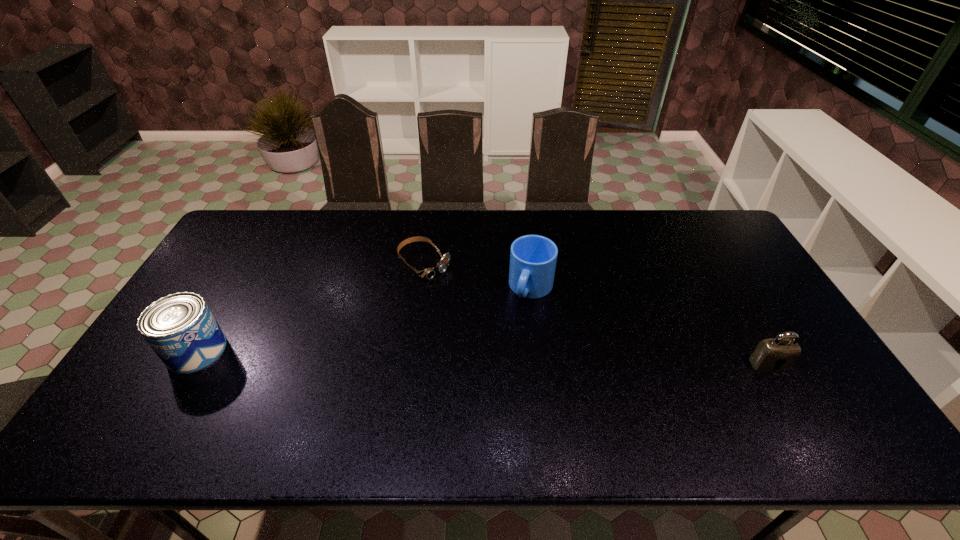
Where is `vacant space on the desktop that is between the leftmost object and the padlock and is positioned on the side of the mug with the handle`? This screenshot has height=540, width=960. vacant space on the desktop that is between the leftmost object and the padlock and is positioned on the side of the mug with the handle is located at coordinates (502, 358).

The width and height of the screenshot is (960, 540). Identify the location of free space on the desktop that is between the can and the rightmost object and is positioned on the front-facing side of the third object from right to left. (529, 359).